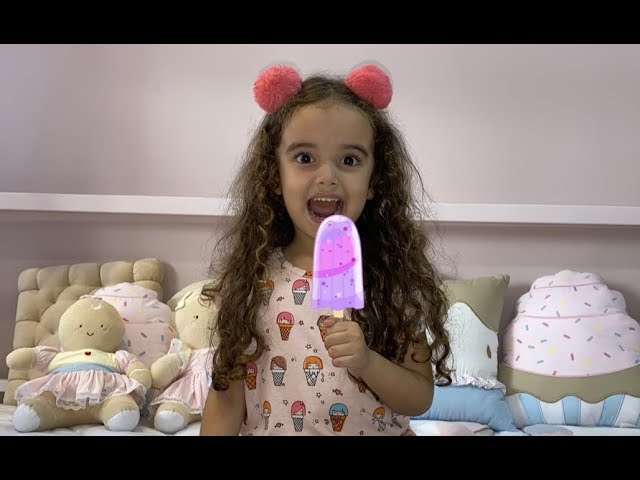
Locate an element on the screen. This screenshot has height=480, width=640. bed is located at coordinates (138, 428).